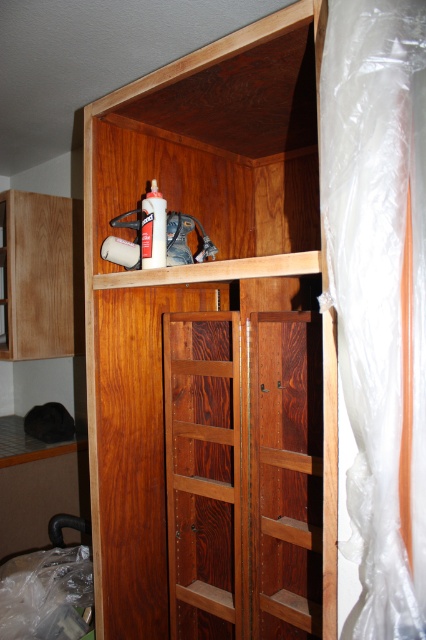
Question: Does wooden cabinet at upper center come behind matte white spray can at upper center?

Choices:
 (A) no
 (B) yes

Answer: (A)

Question: Considering the real-world distances, which object is farthest from the matte wood shelf at left?

Choices:
 (A) matte white spray can at upper center
 (B) wooden cabinet at upper center

Answer: (A)

Question: Can you confirm if matte wood shelf at left is smaller than matte white spray can at upper center?

Choices:
 (A) no
 (B) yes

Answer: (A)

Question: Is wooden cabinet at upper center smaller than matte wood shelf at left?

Choices:
 (A) yes
 (B) no

Answer: (B)

Question: Estimate the real-world distances between objects in this image. Which object is closer to the matte white spray can at upper center?

Choices:
 (A) matte wood shelf at left
 (B) wooden cabinet at upper center

Answer: (B)

Question: Which object is positioned closest to the matte wood shelf at left?

Choices:
 (A) matte white spray can at upper center
 (B) wooden cabinet at upper center

Answer: (B)